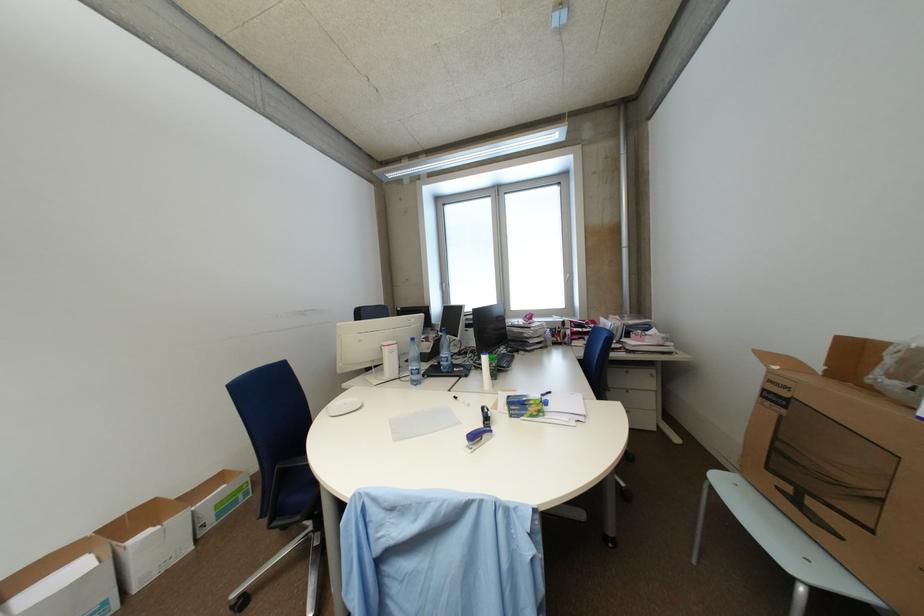
This screenshot has height=616, width=924. Find the location of `purple stapler`. purple stapler is located at coordinates (478, 437).